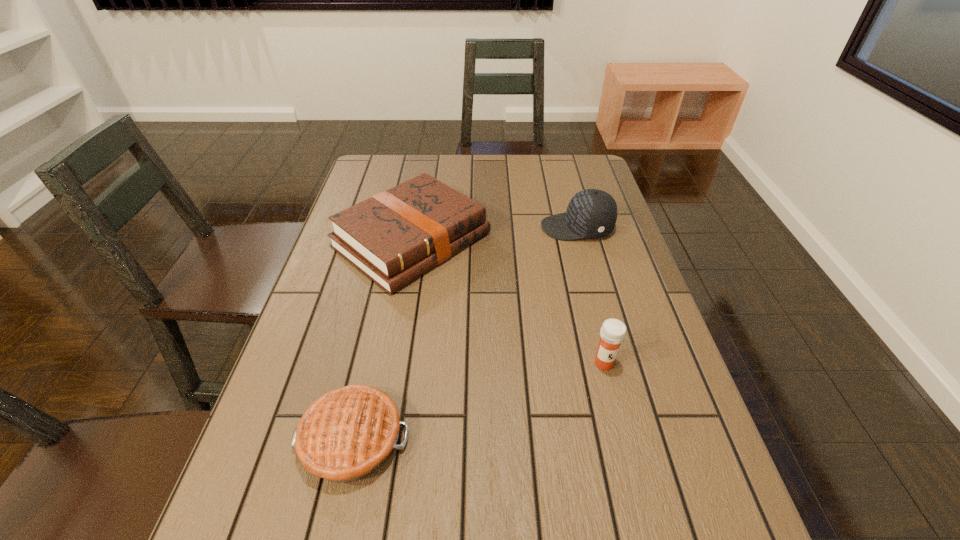
The image size is (960, 540). In order to click on empty space between the nearest object and the second shortest object in this screenshot , I will do `click(382, 340)`.

Identify the location of empty location between the shortest object and the baseball cap. The height and width of the screenshot is (540, 960). (465, 333).

I want to click on empty location between the third tallest object and the third farthest object, so click(x=508, y=301).

Identify the location of unoccupied area between the baseball cap and the shortest object. (465, 333).

You are a GUI agent. You are given a task and a screenshot of the screen. Output one action in this format:
    pyautogui.click(x=<x>, y=<y>)
    Task: Click on the free area in between the hardback book and the third farthest object
    Image resolution: width=960 pixels, height=540 pixels.
    Given the screenshot: What is the action you would take?
    pyautogui.click(x=508, y=301)

This screenshot has height=540, width=960. What are the coordinates of `empty space that is in between the second shortest object and the baseball cap` in the screenshot? It's located at [494, 234].

Identify the location of empty space between the second shortest object and the medicine. The height and width of the screenshot is (540, 960). [508, 301].

Find the location of a particular element. Image resolution: width=960 pixels, height=540 pixels. vacant space in between the nearest object and the baseball cap is located at coordinates click(465, 333).

Identify the location of free space between the pie and the baseball cap. The height and width of the screenshot is (540, 960). (465, 333).

This screenshot has width=960, height=540. Identify the location of free point between the third farthest object and the baseball cap. (590, 295).